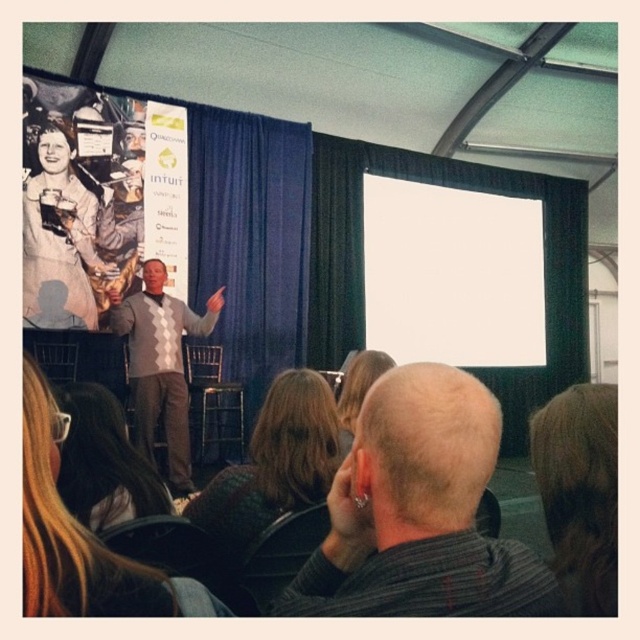
You are an event planner checking the seating arrangement. You notice the gray striped sweater at lower center and the brown hair at upper right. Which object is taller?

The gray striped sweater at lower center is taller than the brown hair at upper right.

You are sitting in the audience at the back of the tented venue. You notice two items at the center of the stage. Which one is closer to you, the blonde hair at center or the knitted sweater at center?

The blonde hair at center is closer to the viewer than the knitted sweater at center, so the blonde hair at center is closer to you.

You are sitting at the back of the tented venue and want to ask a question to the presenter. You notice the gray striped sweater at lower center and the brown hair at upper right. Which object is closer to you?

The gray striped sweater at lower center is closer to the viewer than the brown hair at upper right.